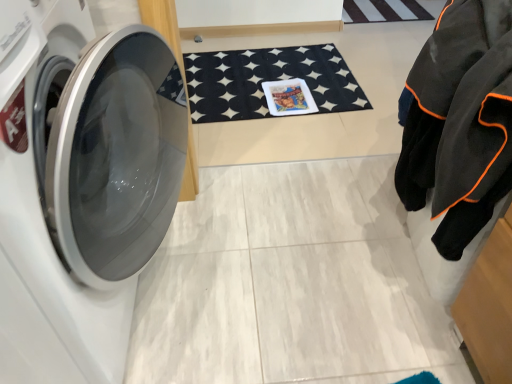
Question: Could you tell me if white glossy washing machine at left is turned towards black felt bath mat at center?

Choices:
 (A) no
 (B) yes

Answer: (A)

Question: Considering the relative sizes of white glossy washing machine at left and black felt bath mat at center in the image provided, is white glossy washing machine at left thinner than black felt bath mat at center?

Choices:
 (A) no
 (B) yes

Answer: (A)

Question: Is white glossy washing machine at left looking in the opposite direction of black felt bath mat at center?

Choices:
 (A) no
 (B) yes

Answer: (A)

Question: From the image's perspective, does white glossy washing machine at left appear lower than black felt bath mat at center?

Choices:
 (A) yes
 (B) no

Answer: (A)

Question: Can you confirm if white glossy washing machine at left is bigger than black felt bath mat at center?

Choices:
 (A) no
 (B) yes

Answer: (B)

Question: Is white glossy washing machine at left to the right of black felt bath mat at center from the viewer's perspective?

Choices:
 (A) yes
 (B) no

Answer: (B)

Question: Does black felt bath mat at center have a lesser width compared to white glossy washing machine at left?

Choices:
 (A) no
 (B) yes

Answer: (B)

Question: From the image's perspective, is black felt bath mat at center above white glossy washing machine at left?

Choices:
 (A) yes
 (B) no

Answer: (A)

Question: Does black felt bath mat at center come behind white glossy washing machine at left?

Choices:
 (A) no
 (B) yes

Answer: (B)

Question: Is black felt bath mat at center facing towards white glossy washing machine at left?

Choices:
 (A) yes
 (B) no

Answer: (B)

Question: Is black felt bath mat at center positioned far away from white glossy washing machine at left?

Choices:
 (A) no
 (B) yes

Answer: (B)

Question: Is black felt bath mat at center shorter than white glossy washing machine at left?

Choices:
 (A) yes
 (B) no

Answer: (A)

Question: Is black felt bath mat at center at the back of black fleece jacket at right?

Choices:
 (A) no
 (B) yes

Answer: (A)